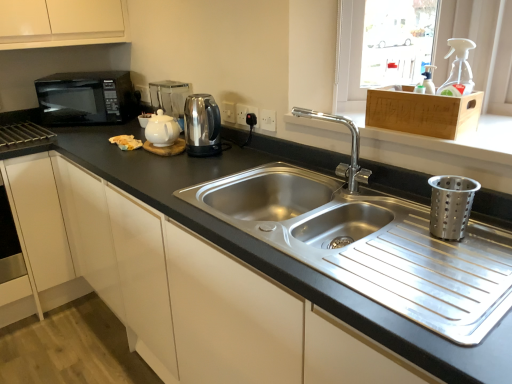
Where is `vacant space to the left of stainless steel kettle at center`? vacant space to the left of stainless steel kettle at center is located at coordinates (162, 164).